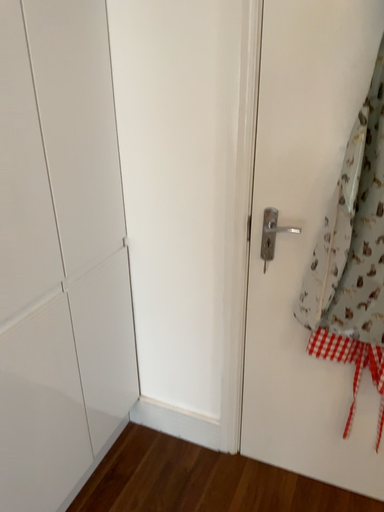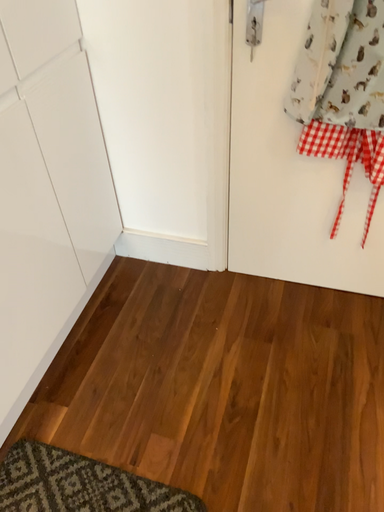
Question: How did the camera likely rotate when shooting the video?

Choices:
 (A) rotated downward
 (B) rotated upward

Answer: (A)